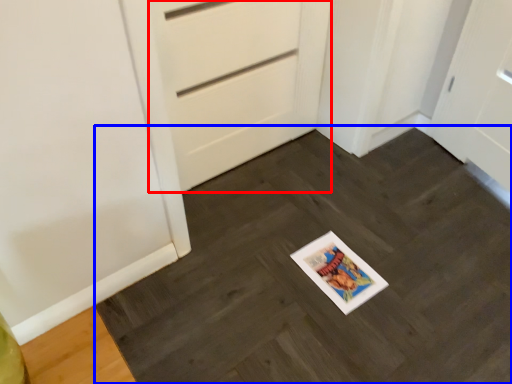
Question: Which of the following is the farthest to the observer, door (highlighted by a red box) or slate (highlighted by a blue box)?

Choices:
 (A) door
 (B) slate

Answer: (A)